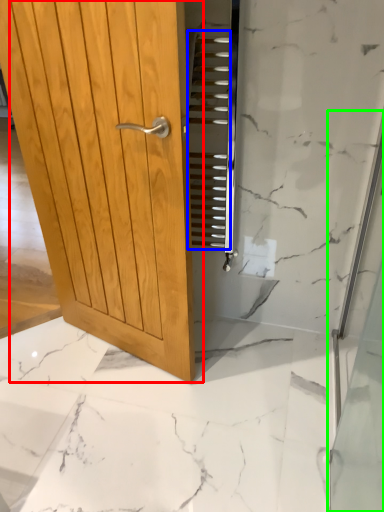
Question: Estimate the real-world distances between objects in this image. Which object is closer to door (highlighted by a red box), stair (highlighted by a blue box) or shower door (highlighted by a green box)?

Choices:
 (A) stair
 (B) shower door

Answer: (A)